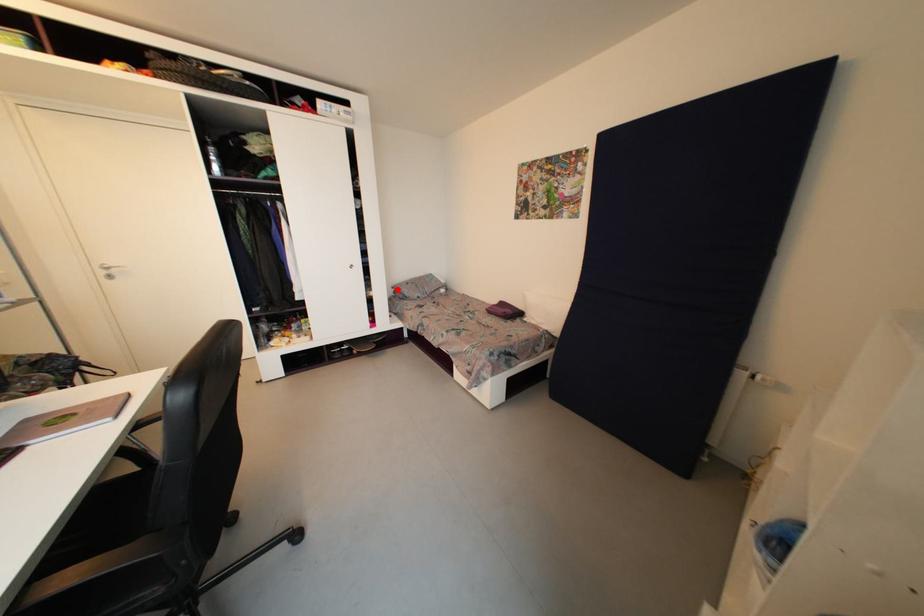
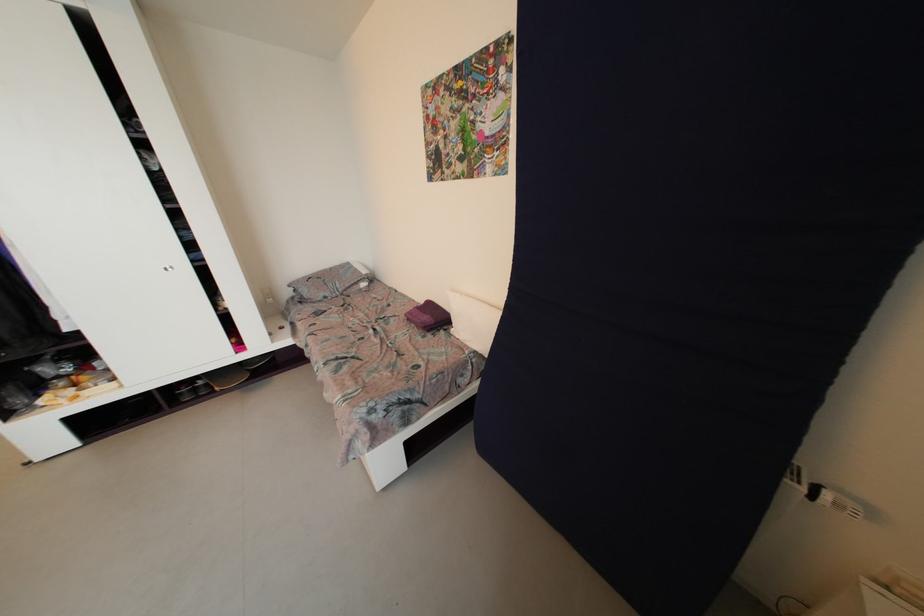
Question: I am providing you with two images of the same scene from different viewpoints. A red point is marked on the first image. Can you still see the location of the red point in image 2?

Choices:
 (A) Yes
 (B) No

Answer: (A)